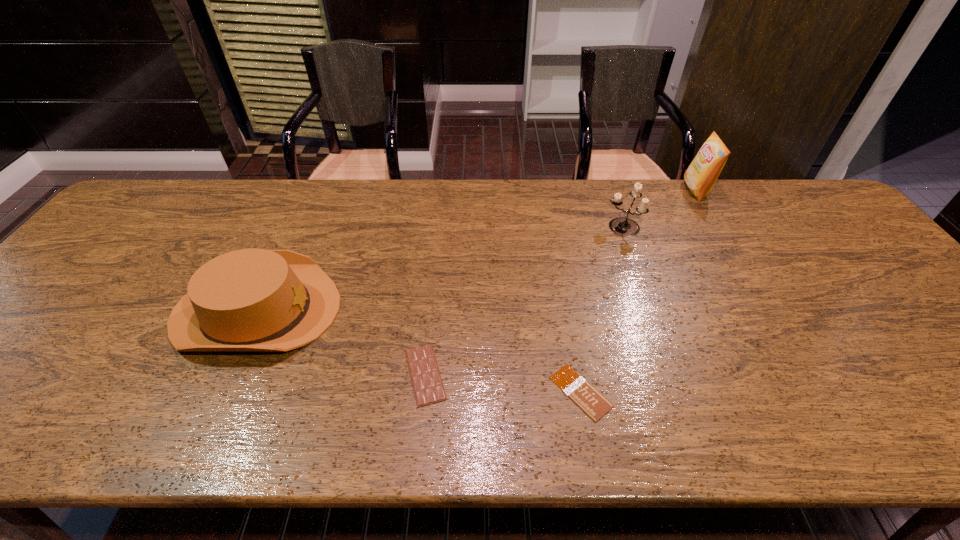
Locate an element on the screen. This screenshot has width=960, height=540. free space between the taller chocolate bar and the right chocolate bar is located at coordinates (503, 383).

Identify the location of free space between the third tallest object and the fourth nearest object. (440, 268).

Where is `vacant space in between the second farthest object and the shortest object`? The height and width of the screenshot is (540, 960). vacant space in between the second farthest object and the shortest object is located at coordinates (601, 309).

Image resolution: width=960 pixels, height=540 pixels. In order to click on object that is the second closest to the fourth object from left to right in this screenshot , I will do `click(582, 393)`.

This screenshot has width=960, height=540. In order to click on object that stands as the fourth closest to the third object from left to right in this screenshot , I will do `click(701, 175)`.

Find the location of `blank area in the image that satisfies the following two spatial constraints: 1. on the back side of the candle holder; 2. on the left side of the fourth object from right to left`. blank area in the image that satisfies the following two spatial constraints: 1. on the back side of the candle holder; 2. on the left side of the fourth object from right to left is located at coordinates (440, 227).